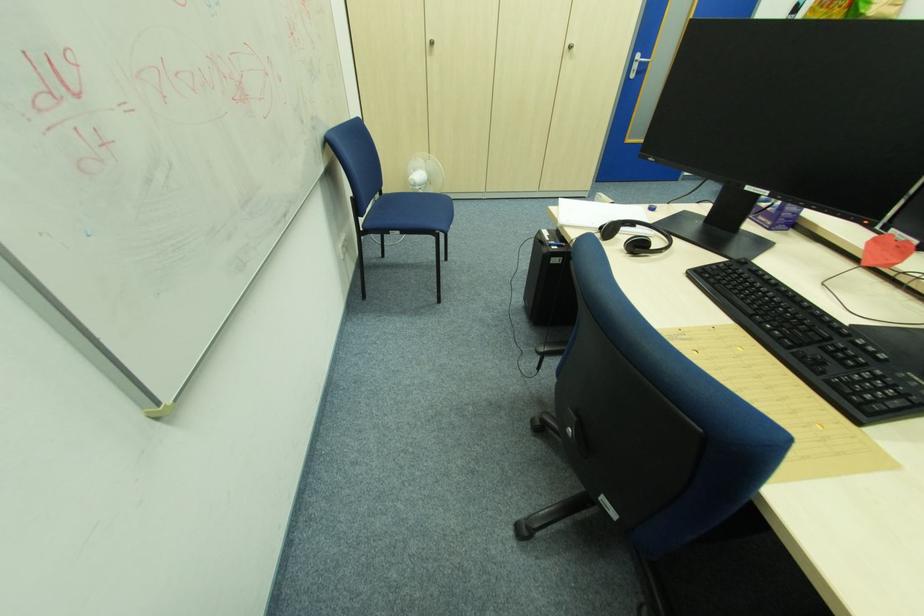
This screenshot has width=924, height=616. I want to click on spiral notebook, so click(x=585, y=213).